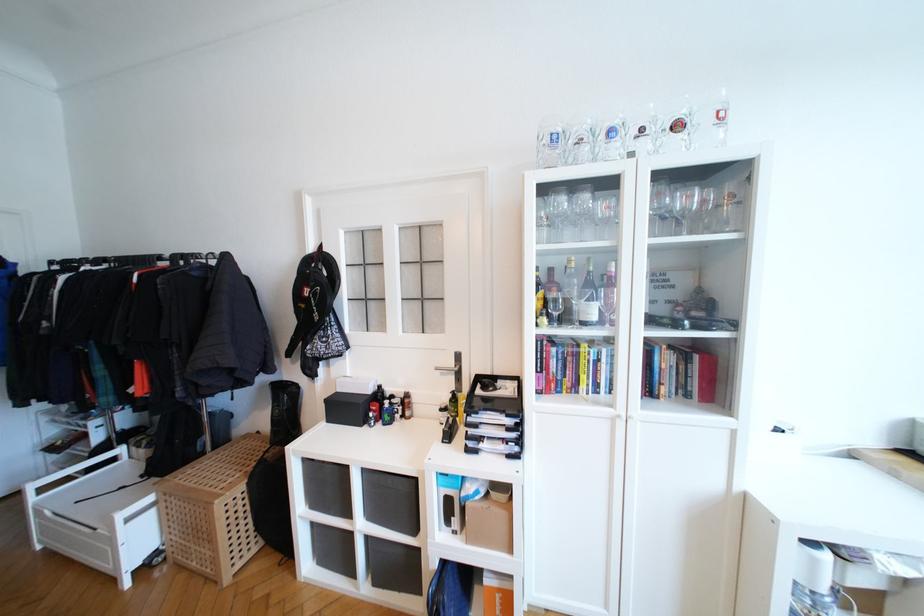
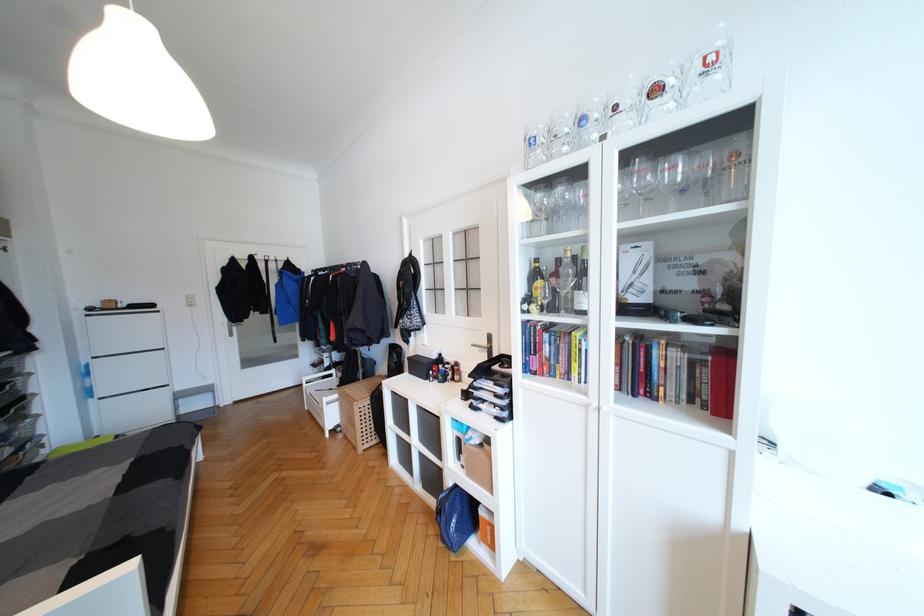
In the second image, find the point that corresponds to (455,363) in the first image.

(488, 344)